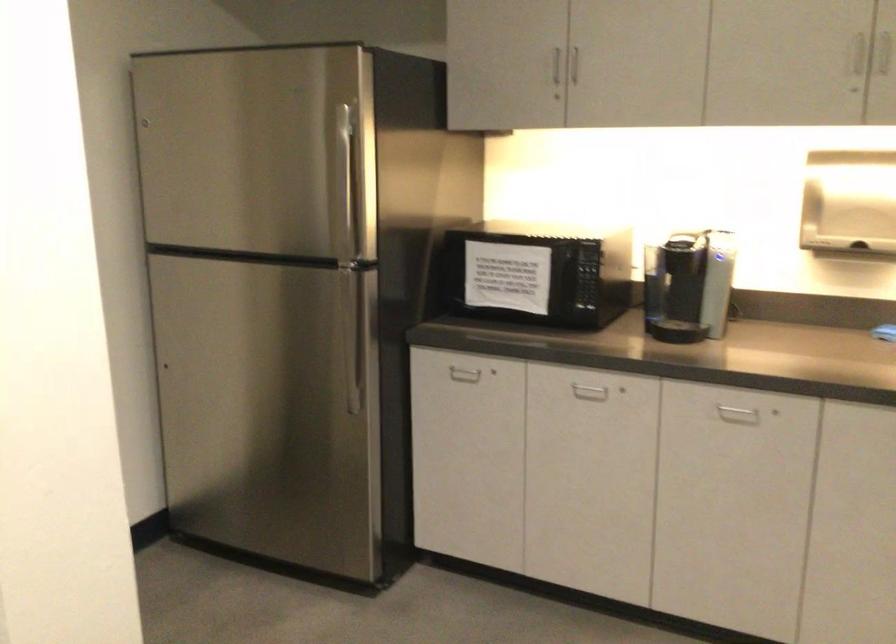
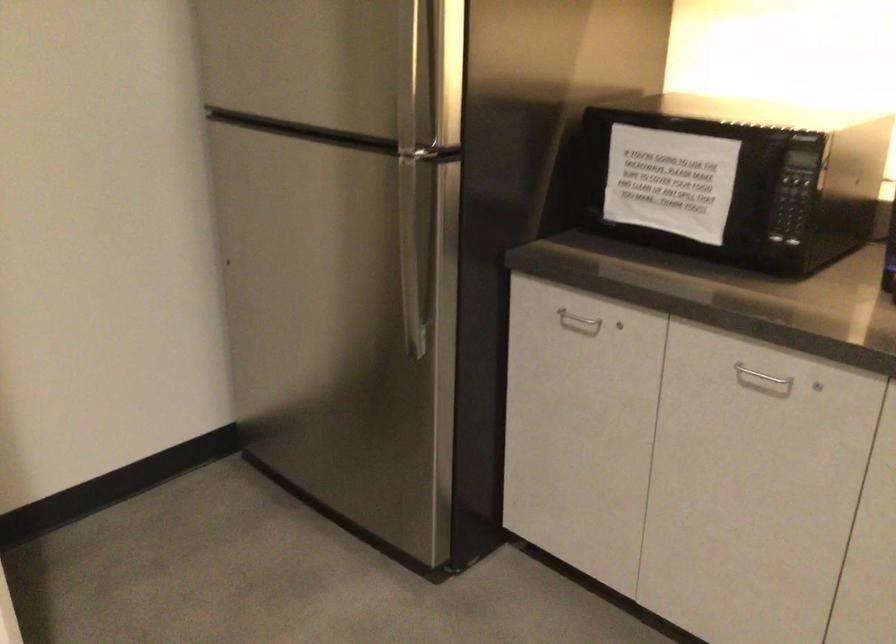
Question: The camera is either moving clockwise (left) or counter-clockwise (right) around the object. The first image is from the beginning of the video and the second image is from the end. Is the camera moving left or right when shooting the video?

Choices:
 (A) Left
 (B) Right

Answer: (B)